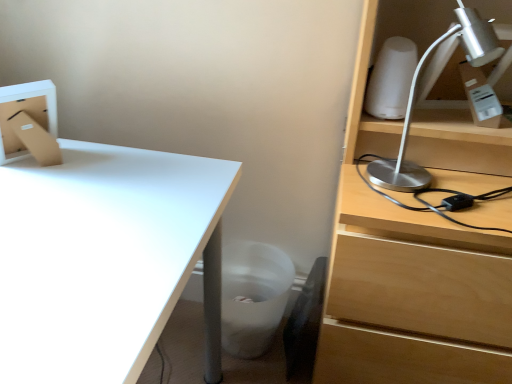
Question: Does white matte trash bin/can at lower center lie in front of black leather swivel chair at lower center?

Choices:
 (A) no
 (B) yes

Answer: (A)

Question: Can you confirm if white matte trash bin/can at lower center is smaller than black leather swivel chair at lower center?

Choices:
 (A) no
 (B) yes

Answer: (A)

Question: From the image's perspective, does white matte trash bin/can at lower center appear lower than black leather swivel chair at lower center?

Choices:
 (A) no
 (B) yes

Answer: (A)

Question: Considering the relative sizes of white matte trash bin/can at lower center and black leather swivel chair at lower center in the image provided, is white matte trash bin/can at lower center shorter than black leather swivel chair at lower center?

Choices:
 (A) yes
 (B) no

Answer: (A)

Question: Does white matte trash bin/can at lower center have a lesser width compared to black leather swivel chair at lower center?

Choices:
 (A) no
 (B) yes

Answer: (A)

Question: From a real-world perspective, is black leather swivel chair at lower center above or below white matte trash bin/can at lower center?

Choices:
 (A) below
 (B) above

Answer: (B)

Question: Based on their sizes in the image, would you say black leather swivel chair at lower center is bigger or smaller than white matte trash bin/can at lower center?

Choices:
 (A) small
 (B) big

Answer: (A)

Question: Visually, is black leather swivel chair at lower center positioned to the left or to the right of white matte trash bin/can at lower center?

Choices:
 (A) left
 (B) right

Answer: (B)

Question: Is black leather swivel chair at lower center inside or outside of white matte trash bin/can at lower center?

Choices:
 (A) inside
 (B) outside

Answer: (A)

Question: Is point (66, 273) closer or farther from the camera than point (408, 104)?

Choices:
 (A) farther
 (B) closer

Answer: (B)

Question: In terms of size, does white glossy desk at lower left appear bigger or smaller than silver metallic desk lamp at upper right?

Choices:
 (A) small
 (B) big

Answer: (B)

Question: From the image's perspective, is white glossy desk at lower left located above or below silver metallic desk lamp at upper right?

Choices:
 (A) above
 (B) below

Answer: (B)

Question: Looking at their shapes, would you say white glossy desk at lower left is wider or thinner than silver metallic desk lamp at upper right?

Choices:
 (A) thin
 (B) wide

Answer: (B)

Question: In terms of size, does white glossy desk at lower left appear bigger or smaller than white matte trash bin/can at lower center?

Choices:
 (A) small
 (B) big

Answer: (B)

Question: Is white glossy desk at lower left taller or shorter than white matte trash bin/can at lower center?

Choices:
 (A) short
 (B) tall

Answer: (B)